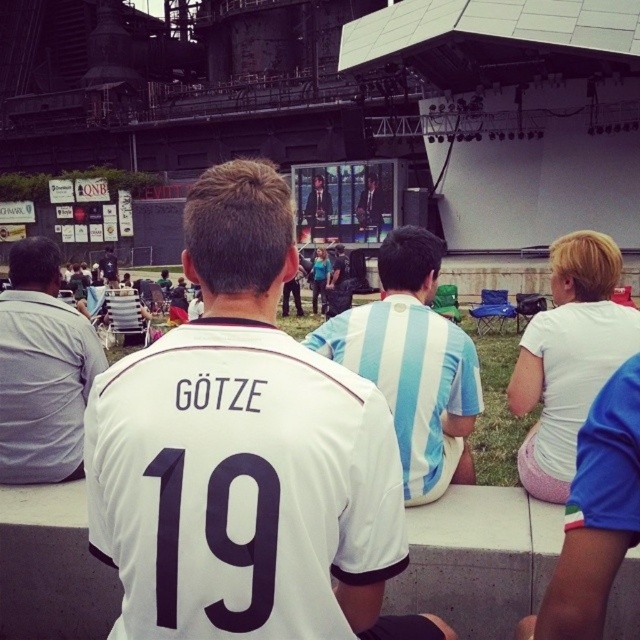
You are a photographer trying to capture a wide shot of the event. Given that the gray cotton shirt at left and the white matte shorts at lower right are in your frame, which object should you focus on to ensure both are fully visible in the photo?

The gray cotton shirt at left is wider than the white matte shorts at lower right, so focusing on the gray cotton shirt at left would ensure both objects are fully visible in the photo.